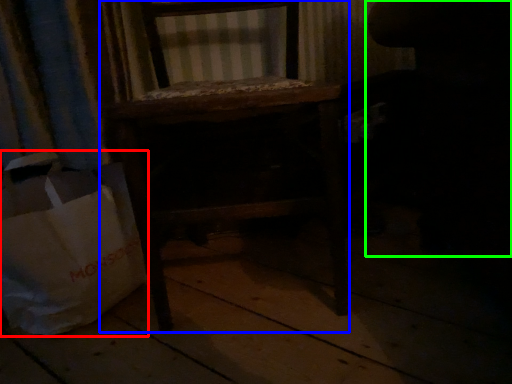
Question: Estimate the real-world distances between objects in this image. Which object is closer to grocery bag (highlighted by a red box), furniture (highlighted by a blue box) or swivel chair (highlighted by a green box)?

Choices:
 (A) furniture
 (B) swivel chair

Answer: (A)